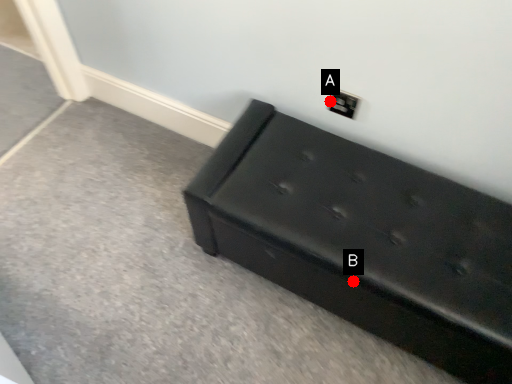
Question: Two points are circled on the image, labeled by A and B beside each circle. Which point is further to the camera?

Choices:
 (A) A is further
 (B) B is further

Answer: (A)